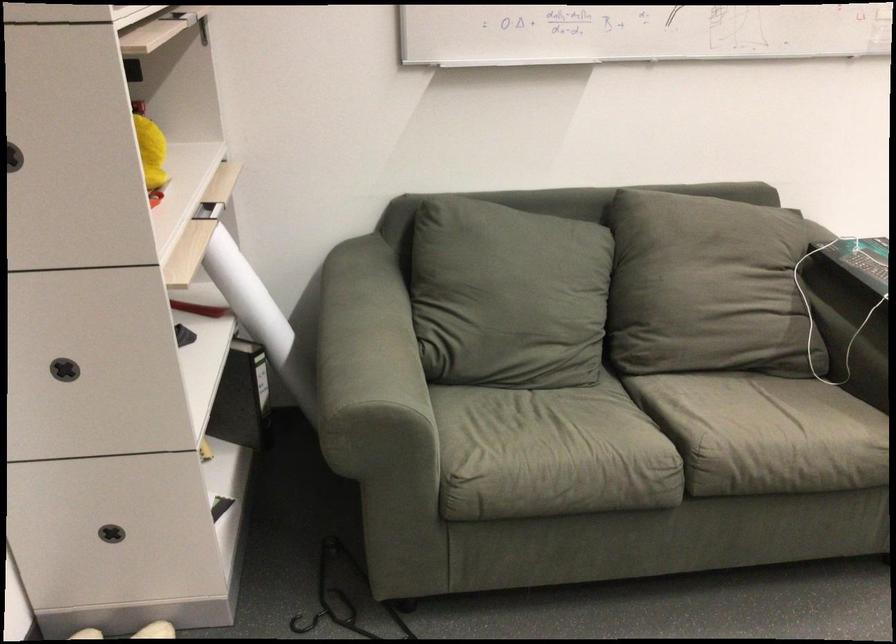
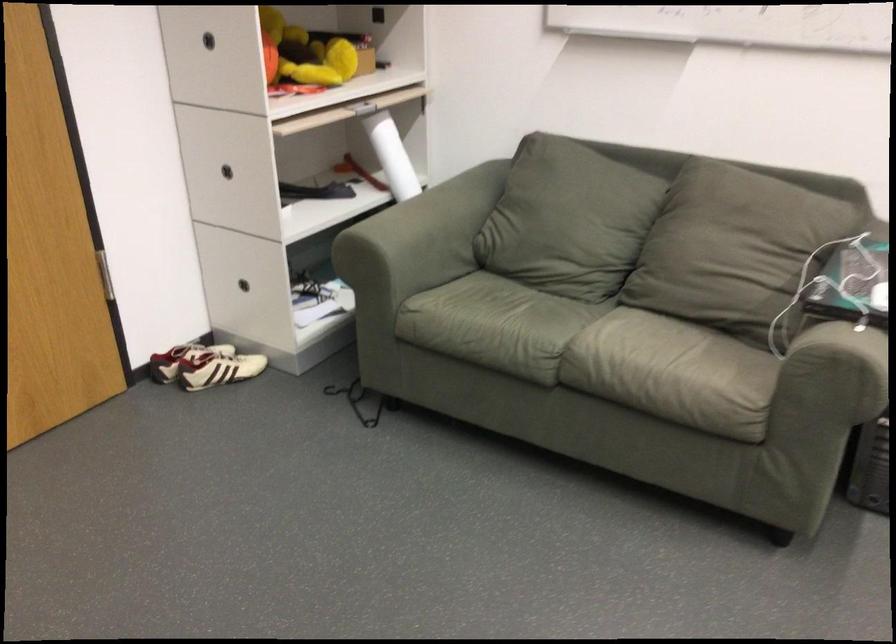
The point at (579, 451) is marked in the first image. Where is the corresponding point in the second image?

(495, 325)